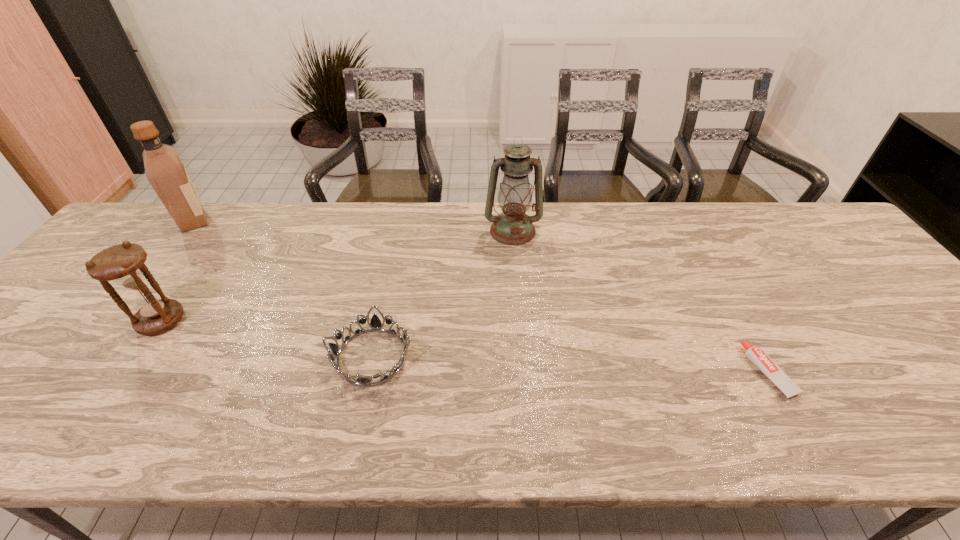
Locate an element on the screen. object that is the fourth closest to the oil lamp is located at coordinates (164, 169).

Where is `free space in the image that satisfies the following two spatial constraints: 1. on the front-facing side of the shortest object; 2. on the left side of the liquor`? free space in the image that satisfies the following two spatial constraints: 1. on the front-facing side of the shortest object; 2. on the left side of the liquor is located at coordinates (75, 372).

Find the location of a particular element. This screenshot has width=960, height=540. vacant space that satisfies the following two spatial constraints: 1. on the front-facing side of the toothpaste; 2. on the left side of the tiara is located at coordinates 369,372.

You are a GUI agent. You are given a task and a screenshot of the screen. Output one action in this format:
    pyautogui.click(x=<x>, y=<y>)
    Task: Click on the vacant area that satisfies the following two spatial constraints: 1. on the front-facing side of the liquor; 2. on the left side of the third tallest object
    This screenshot has width=960, height=540.
    Given the screenshot: What is the action you would take?
    pyautogui.click(x=114, y=320)

Locate an element on the screen. The height and width of the screenshot is (540, 960). blank space that satisfies the following two spatial constraints: 1. on the front-facing side of the shortest object; 2. on the left side of the liquor is located at coordinates (75, 372).

Locate an element on the screen. The height and width of the screenshot is (540, 960). vacant space that satisfies the following two spatial constraints: 1. on the back side of the shortest object; 2. on the front-facing side of the third object from left to right is located at coordinates (760, 356).

The height and width of the screenshot is (540, 960). In order to click on free space that satisfies the following two spatial constraints: 1. on the front-facing side of the liquor; 2. on the right side of the second object from right to left in this screenshot , I will do `click(184, 231)`.

At what (x,y) coordinates should I click in order to perform the action: click on vacant space that satisfies the following two spatial constraints: 1. on the front-facing side of the liquor; 2. on the right side of the third tallest object. Please return your answer as a coordinate pair (x, y). The width and height of the screenshot is (960, 540). Looking at the image, I should click on (114, 320).

Identify the location of free location that satisfies the following two spatial constraints: 1. on the back side of the oil lamp; 2. on the left side of the third shortest object. The image size is (960, 540). (222, 231).